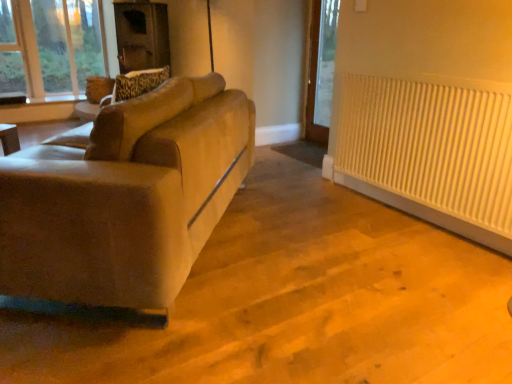
Where is `vacant region under white ribbed radiator at right (from a real-world perspective)`? This screenshot has width=512, height=384. vacant region under white ribbed radiator at right (from a real-world perspective) is located at coordinates (412, 209).